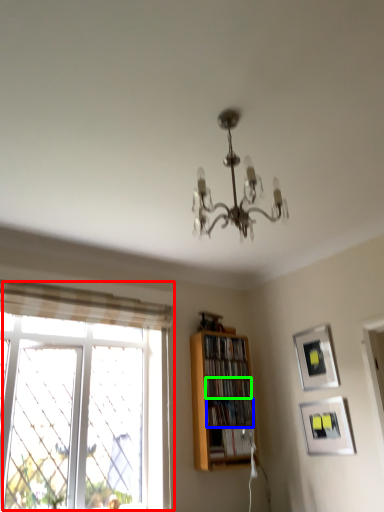
Question: Which object is the closest to the window (highlighted by a red box)? Choose among these: book (highlighted by a blue box) or book (highlighted by a green box).

Choices:
 (A) book
 (B) book

Answer: (A)